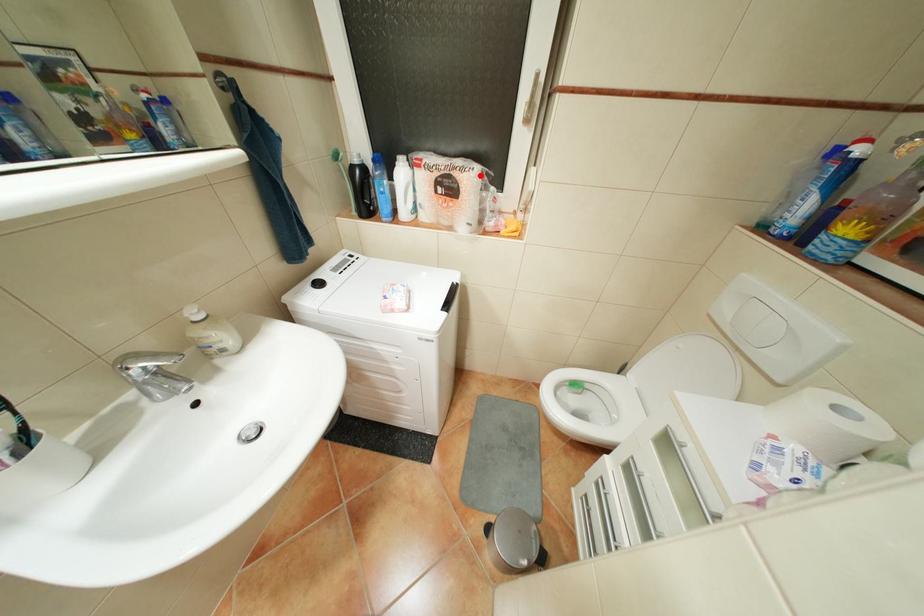
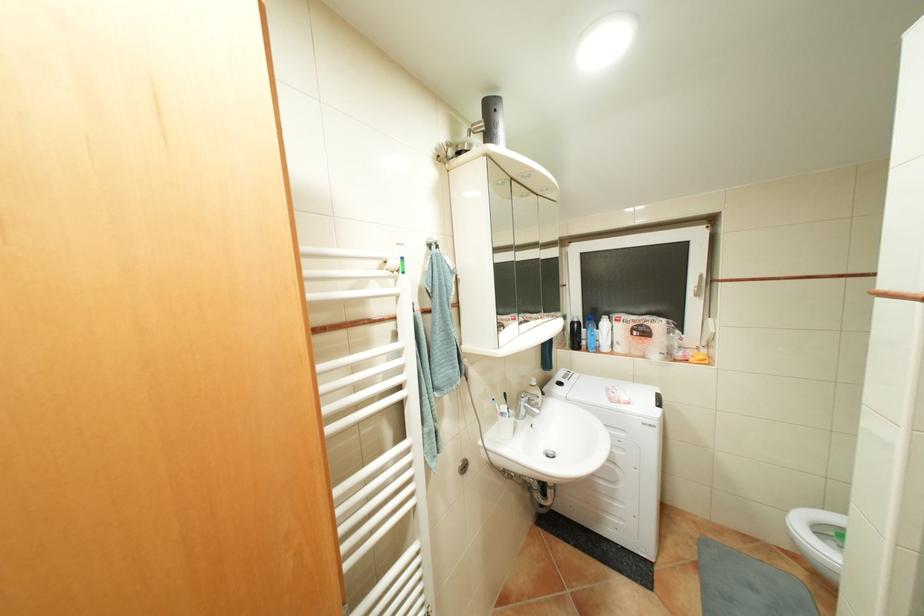
Question: I am providing you with two images of the same scene from different viewpoints. Given a red point in image1, look at the same physical point in image2. Is it:

Choices:
 (A) Closer to the viewpoint
 (B) Farther from the viewpoint

Answer: (B)